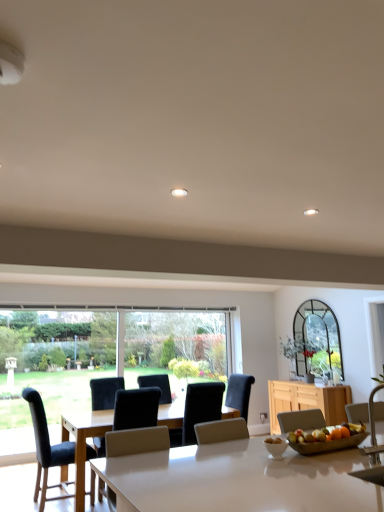
You are a GUI agent. You are given a task and a screenshot of the screen. Output one action in this format:
    pyautogui.click(x=<x>, y=<y>)
    Task: Click on the white glossy bowl at center
    The image size is (384, 512).
    Given the screenshot: What is the action you would take?
    pyautogui.click(x=276, y=446)

What do you see at coordinates (46, 448) in the screenshot? I see `black leather chair at left, the 3th chair from the front` at bounding box center [46, 448].

What is the approximate height of metallic silver chair at right, which appears as the 1th chair when viewed from the front?

The height of metallic silver chair at right, which appears as the 1th chair when viewed from the front, is 16.31 inches.

Where is `wooden cabinet at right`? The height and width of the screenshot is (512, 384). wooden cabinet at right is located at coordinates (307, 400).

Locate an element on the screen. This screenshot has width=384, height=512. white glossy bowl at center is located at coordinates (276, 446).

From a real-world perspective, which is physically above, metallic silver chair at right, the fourth chair when ordered from left to right, or black leather chair at center, the second chair in the right-to-left sequence?

In real-world perspective, metallic silver chair at right, the fourth chair when ordered from left to right, is above.

Are metallic silver chair at right, the fourth chair when ordered from left to right, and black leather chair at center, which is counted as the 3th chair, starting from the left, making contact?

No, metallic silver chair at right, the fourth chair when ordered from left to right, is not in contact with black leather chair at center, which is counted as the 3th chair, starting from the left.

From the image's perspective, between metallic silver chair at right, the fourth chair positioned from the back, and black leather chair at center, the 4th chair positioned from the front, who is located below?

From the image's view, black leather chair at center, the 4th chair positioned from the front, is below.

Which is correct: metallic silver chair at right, the fourth chair positioned from the back, is inside black leather chair at center, positioned as the 1th chair in back-to-front order, or outside of it?

metallic silver chair at right, the fourth chair positioned from the back, lies outside black leather chair at center, positioned as the 1th chair in back-to-front order.

Is point (291, 405) closer or farther from the camera than point (339, 467)?

Clearly, point (291, 405) is more distant from the camera than point (339, 467).

Would you say wooden cabinet at right is to the left or to the right of white glossy table at center in the picture?

wooden cabinet at right is to the right of white glossy table at center.

Locate an element on the screen. The image size is (384, 512). cabinetry that appears below the white glossy table at center (from a real-world perspective) is located at coordinates (307, 400).

Based on the photo, is black leather chair at left, the 2th chair positioned from the back, at the back of white glossy bowl at center?

No, white glossy bowl at center's orientation is not away from black leather chair at left, the 2th chair positioned from the back.

Is white glossy bowl at center in front of or behind black leather chair at left, which ranks as the 1th chair in left-to-right order, in the image?

In the image, white glossy bowl at center appears in front of black leather chair at left, which ranks as the 1th chair in left-to-right order.

From the image's perspective, which is below, white glossy bowl at center or black leather chair at left, the 3th chair from the front?

black leather chair at left, the 3th chair from the front.

Identify the location of chair that is the 3rd one when counting backward from the white glossy table at center. Image resolution: width=384 pixels, height=512 pixels. (46, 448).

Is white glossy table at center not inside black leather chair at left, the 3th chair from the front?

Yes, white glossy table at center is outside of black leather chair at left, the 3th chair from the front.

From the image's perspective, is white glossy table at center located above black leather chair at left, the 2th chair positioned from the back?

Indeed, from the image's perspective, white glossy table at center is shown above black leather chair at left, the 2th chair positioned from the back.

Is white glossy table at center turned away from black leather chair at left, which ranks as the 1th chair in left-to-right order?

No, black leather chair at left, which ranks as the 1th chair in left-to-right order, is not at the back of white glossy table at center.

From a real-world perspective, is white glossy bowl at center located beneath white glossy table at center?

No, from a real-world perspective, white glossy bowl at center is not under white glossy table at center.

From the image's perspective, would you say white glossy bowl at center is shown under white glossy table at center?

Incorrect, from the image's perspective, white glossy bowl at center is higher than white glossy table at center.

Considering the relative positions of white glossy bowl at center and white glossy table at center in the image provided, is white glossy bowl at center in front of white glossy table at center?

No, white glossy bowl at center is further to the viewer.

Between point (271, 450) and point (342, 488), which one is positioned in front?

Point (342, 488)

Which is more to the left, wooden cabinet at right or black leather chair at left, which ranks as the 1th chair in left-to-right order?

black leather chair at left, which ranks as the 1th chair in left-to-right order.

Considering the positions of objects wooden cabinet at right and black leather chair at left, which appears as the 4th chair when viewed from the right, in the image provided, who is behind, wooden cabinet at right or black leather chair at left, which appears as the 4th chair when viewed from the right,?

wooden cabinet at right.

Is wooden cabinet at right thinner than black leather chair at left, which ranks as the 1th chair in left-to-right order?

Correct, the width of wooden cabinet at right is less than that of black leather chair at left, which ranks as the 1th chair in left-to-right order.

Is white glossy table at center wider than velvet black chair at center, positioned as the third chair in back-to-front order?

Yes, white glossy table at center is wider than velvet black chair at center, positioned as the third chair in back-to-front order.

Between white glossy table at center and velvet black chair at center, which is the 2th chair in left-to-right order, which one has more height?

Standing taller between the two is velvet black chair at center, which is the 2th chair in left-to-right order.

In the scene shown: From a real-world perspective, which object stands above the other?

white glossy table at center, from a real-world perspective.

Starting from the metallic silver chair at right, the fourth chair positioned from the back, which chair is the 3rd one behind? Please provide its 2D coordinates.

[(198, 410)]

At what (x,y) coordinates should I click in order to perform the action: click on cabinetry that is under the white glossy table at center (from a real-world perspective). Please return your answer as a coordinate pair (x, y). The width and height of the screenshot is (384, 512). Looking at the image, I should click on (307, 400).

Based on their spatial positions, is metallic silver chair at right, which is the first chair in right-to-left order, or velvet black chair at center, which is the 2th chair in left-to-right order, further from black leather chair at left, which appears as the 4th chair when viewed from the right?

The object further to black leather chair at left, which appears as the 4th chair when viewed from the right, is metallic silver chair at right, which is the first chair in right-to-left order.

Looking at the image, which one is located further to black leather chair at center, the second chair in the right-to-left sequence, metallic silver chair at right, the fourth chair positioned from the back, or black leather chair at left, which appears as the 4th chair when viewed from the right?

metallic silver chair at right, the fourth chair positioned from the back.

Looking at the image, which one is located closer to black leather chair at left, which ranks as the 1th chair in left-to-right order, velvet black chair at center, which is counted as the 2th chair, starting from the front, or metallic silver chair at right, the fourth chair when ordered from left to right?

velvet black chair at center, which is counted as the 2th chair, starting from the front.

Looking at the image, which one is located further to white glossy bowl at center, white glossy table at center or metallic silver chair at right, which is the first chair in right-to-left order?

Among the two, metallic silver chair at right, which is the first chair in right-to-left order, is located further to white glossy bowl at center.

Based on their spatial positions, is velvet black chair at center, which is the 3th chair from right to left, or wooden cabinet at right closer to metallic silver chair at right, which appears as the 1th chair when viewed from the front?

wooden cabinet at right is closer to metallic silver chair at right, which appears as the 1th chair when viewed from the front.

Which object lies nearer to the anchor point white glossy table at center, black leather chair at center, the second chair in the right-to-left sequence, or black leather chair at left, the 2th chair positioned from the back?

Among the two, black leather chair at center, the second chair in the right-to-left sequence, is located nearer to white glossy table at center.

Looking at the image, which one is located closer to metallic silver chair at right, which appears as the 1th chair when viewed from the front, black leather chair at center, the second chair in the right-to-left sequence, or velvet black chair at center, which is counted as the 2th chair, starting from the front?

The object closer to metallic silver chair at right, which appears as the 1th chair when viewed from the front, is black leather chair at center, the second chair in the right-to-left sequence.

Which object lies nearer to the anchor point white glossy bowl at center, metallic silver chair at right, which is the first chair in right-to-left order, or white glossy table at center?

white glossy table at center is positioned closer to the anchor white glossy bowl at center.

At what (x,y) coordinates should I click in order to perform the action: click on bowl between white glossy table at center and wooden cabinet at right from front to back. Please return your answer as a coordinate pair (x, y). Looking at the image, I should click on (276, 446).

Identify the location of bowl between white glossy table at center and velvet black chair at center, which is the 2th chair in left-to-right order, in the front-back direction. (276, 446).

This screenshot has height=512, width=384. In order to click on chair between white glossy table at center and velvet black chair at center, positioned as the third chair in back-to-front order, in the front-back direction in this screenshot , I will do `click(358, 414)`.

Image resolution: width=384 pixels, height=512 pixels. I want to click on bowl positioned between white glossy table at center and black leather chair at center, the second chair in the right-to-left sequence, from near to far, so click(276, 446).